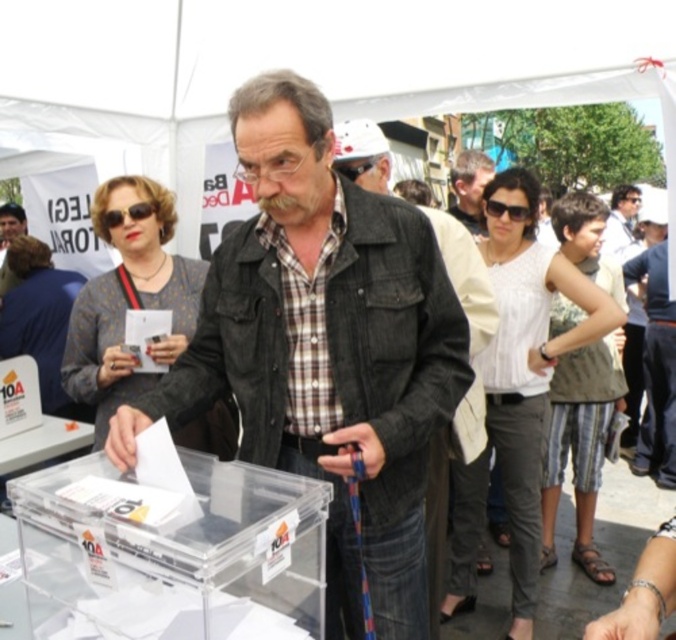
Looking at this image, between denim jacket at center and gray fabric shirt at center, which one appears on the right side from the viewer's perspective?

gray fabric shirt at center

Locate an element on the screen. The width and height of the screenshot is (676, 640). denim jacket at center is located at coordinates (324, 349).

In order to click on denim jacket at center in this screenshot , I will do `click(324, 349)`.